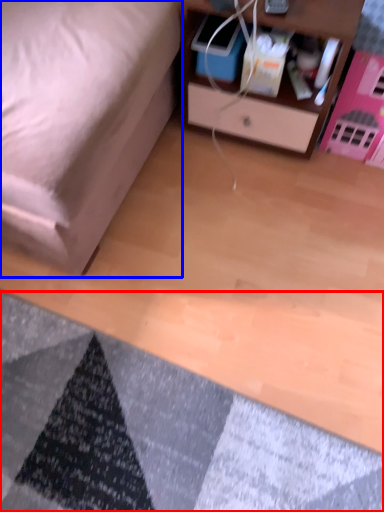
Question: Which object is closer to the camera taking this photo, mat (highlighted by a red box) or furniture (highlighted by a blue box)?

Choices:
 (A) mat
 (B) furniture

Answer: (B)